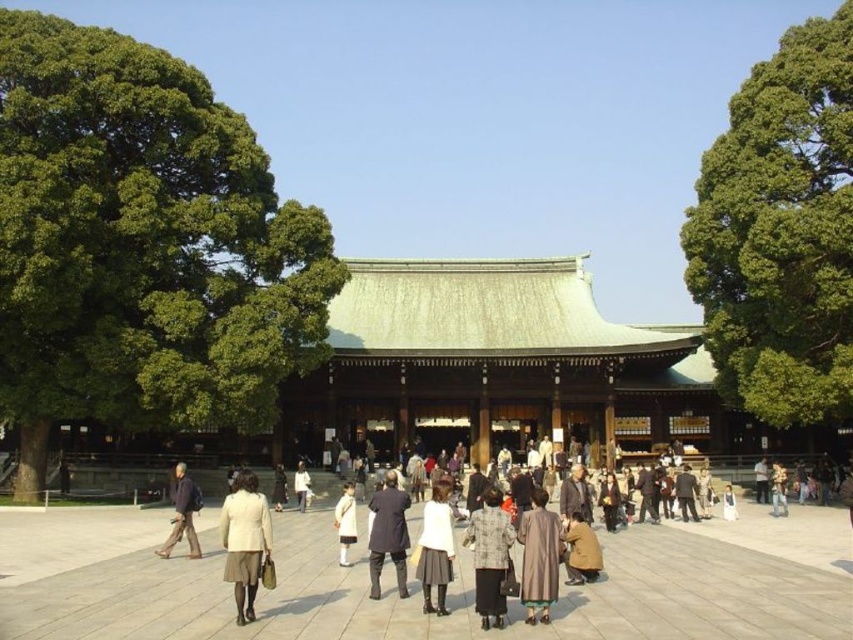
Question: Which object is closer to the camera taking this photo?

Choices:
 (A) dark brown leather jacket at lower left
 (B) light brown leather jacket at center
 (C) plaid wool coat at center

Answer: (C)

Question: Can you confirm if dark brown leather jacket at lower left is positioned below light brown leather jacket at center?

Choices:
 (A) yes
 (B) no

Answer: (B)

Question: Is plaid wool coat at center smaller than dark brown leather coat at center?

Choices:
 (A) yes
 (B) no

Answer: (A)

Question: Among these objects, which one is nearest to the camera?

Choices:
 (A) plaid wool coat at center
 (B) light beige skirt at center

Answer: (A)

Question: Estimate the real-world distances between objects in this image. Which object is closer to the dark brown leather coat at center?

Choices:
 (A) brown textured coat at center
 (B) plaid wool coat at center
 (C) dark brown leather jacket at lower left

Answer: (B)

Question: Can you confirm if brown textured coat at center is positioned above light brown leather jacket at center?

Choices:
 (A) yes
 (B) no

Answer: (A)